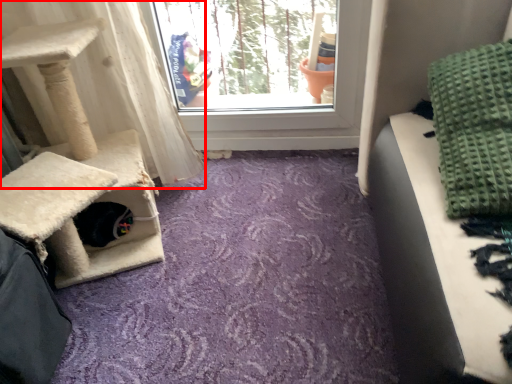
Question: From the image's perspective, what is the correct spatial relationship of curtain (annotated by the red box) in relation to blanket?

Choices:
 (A) above
 (B) below

Answer: (B)